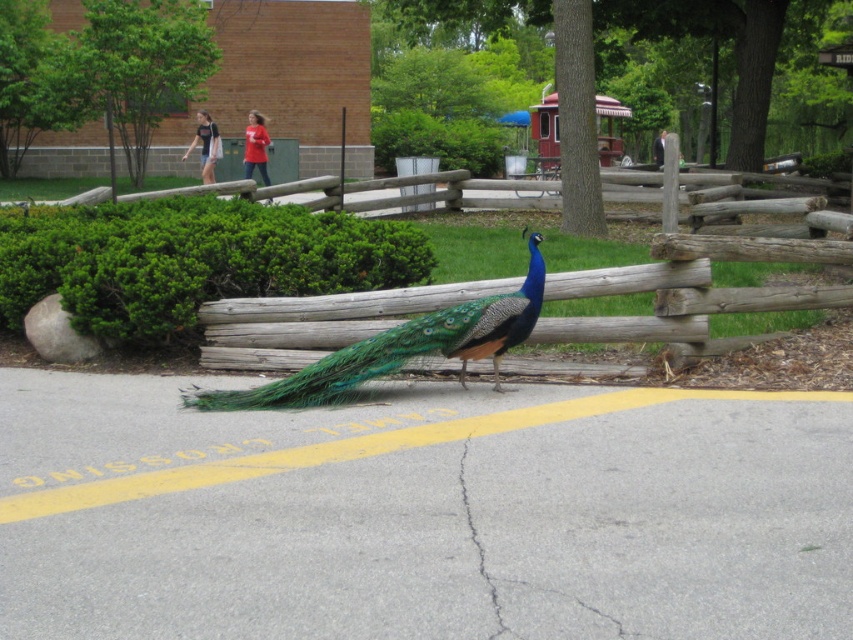
You are a city planner assessing road safety. You notice the wooden fence at center and the gray concrete crack at center on the road. Which of these two objects has a greater width?

The wooden fence at center has a greater width than the gray concrete crack at center.

You are standing at the point closer to the camera. Which point are you at, point [604,339] or point [415,321]?

You are at point [604,339] because it is closer to the camera than point [415,321].

You are a delivery person who needs to cross the road to deliver a package to the address behind the wooden fence. The shiny blue peacock at center is currently blocking your path. Can you safely navigate around it to reach the fence without disturbing it?

Yes, you can safely navigate around the shiny blue peacock at center since it is positioned at point (401, 348), which allows for space to move around it while avoiding disturbance.